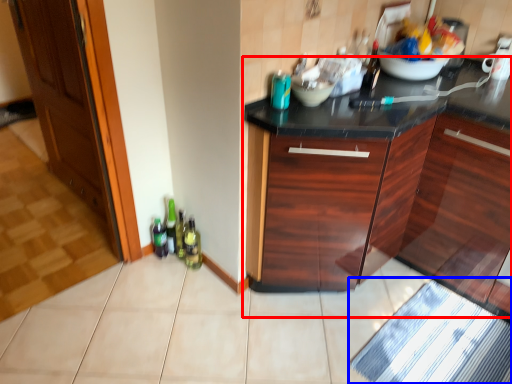
Question: Which of the following is the farthest to the observer, cabinetry (highlighted by a red box) or bath mat (highlighted by a blue box)?

Choices:
 (A) cabinetry
 (B) bath mat

Answer: (B)